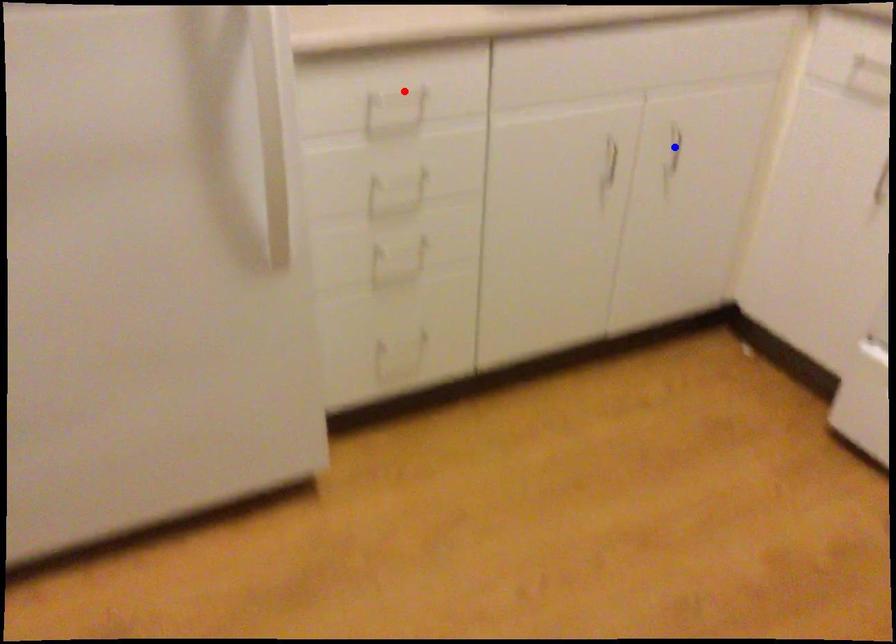
Question: In the image, two points are highlighted. Which point is nearer to the camera? Reply with the corresponding letter.

Choices:
 (A) blue point
 (B) red point

Answer: (B)